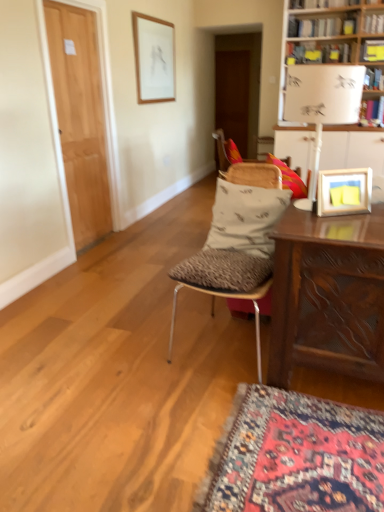
Identify the location of free spot to the left of metallic silver chair at center, which ranks as the second chair in back-to-front order. Image resolution: width=384 pixels, height=512 pixels. (140, 350).